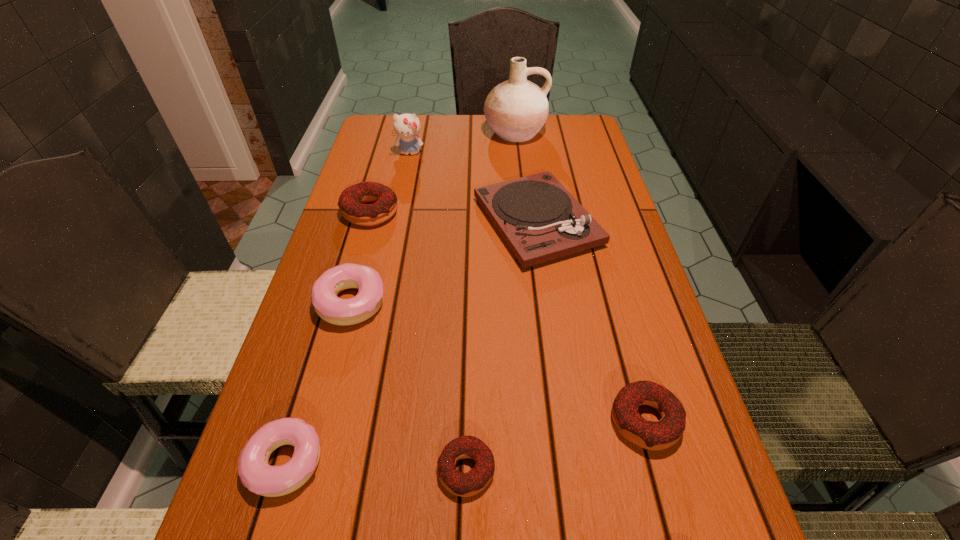
Where is `vacant area situated on the back of the fourth doughnut from left to right`? vacant area situated on the back of the fourth doughnut from left to right is located at coordinates (469, 326).

Locate an element on the screen. pottery located in the far edge section of the desktop is located at coordinates (516, 110).

The width and height of the screenshot is (960, 540). Find the location of `kitten located in the far edge section of the desktop`. kitten located in the far edge section of the desktop is located at coordinates (407, 126).

This screenshot has height=540, width=960. Find the location of `kitten that is positioned at the left edge`. kitten that is positioned at the left edge is located at coordinates (407, 126).

Where is `pottery situated at the right edge`? pottery situated at the right edge is located at coordinates (516, 110).

Locate an element on the screen. This screenshot has width=960, height=540. phonograph_record positioned at the right edge is located at coordinates (537, 217).

Identify the location of doughnut that is positioned at the right edge. The width and height of the screenshot is (960, 540). click(662, 434).

The height and width of the screenshot is (540, 960). I want to click on object at the far left corner, so click(x=407, y=126).

You are a GUI agent. You are given a task and a screenshot of the screen. Output one action in this format:
    pyautogui.click(x=<x>, y=<y>)
    Task: Click on the object located in the far right corner section of the desktop
    This screenshot has height=540, width=960.
    Given the screenshot: What is the action you would take?
    pyautogui.click(x=516, y=110)

Where is `free point at the far edge`? free point at the far edge is located at coordinates (464, 120).